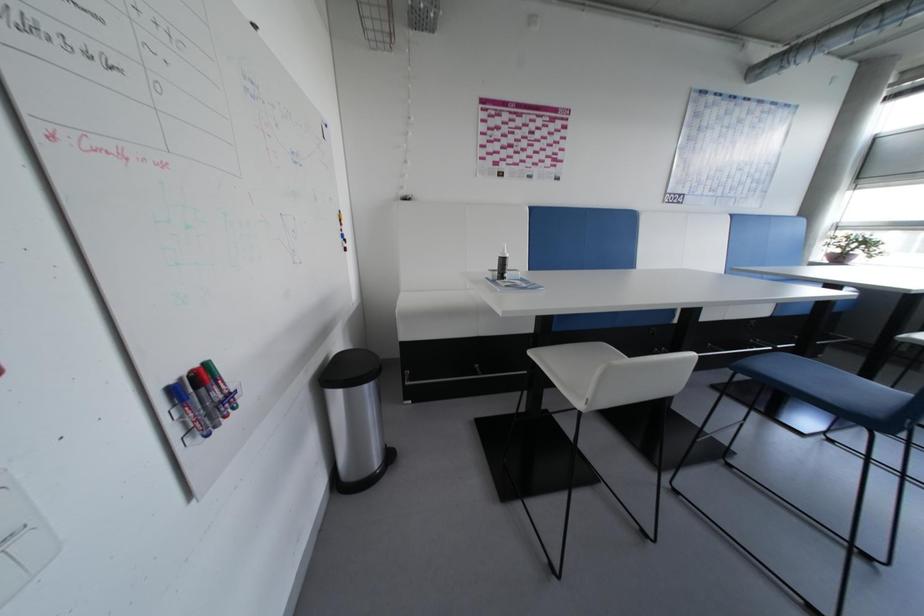
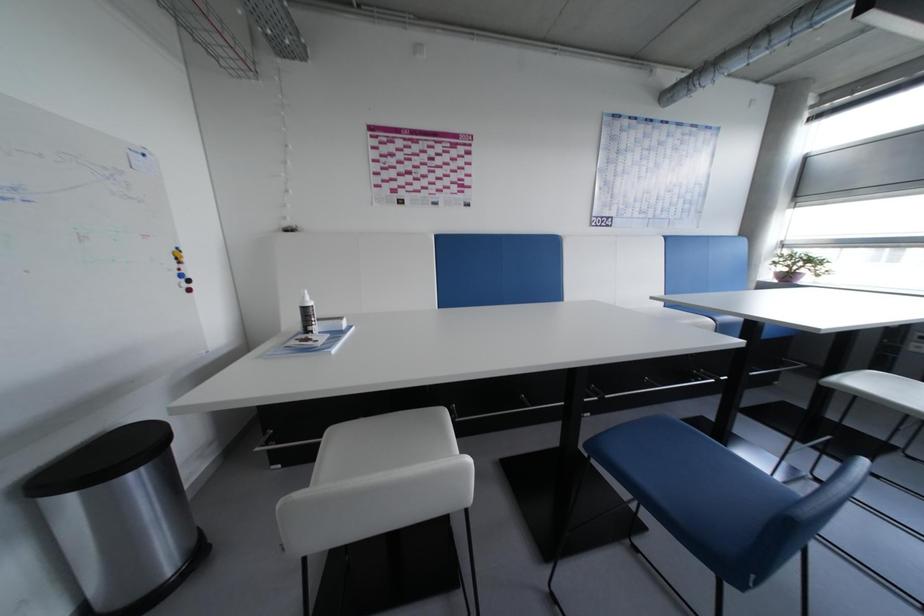
Question: What movement of the cameraman would produce the second image?

Choices:
 (A) Left
 (B) Right
 (C) Forward
 (D) Backward

Answer: (B)